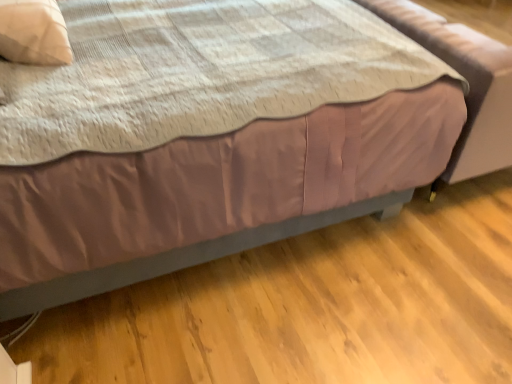
What do you see at coordinates (468, 82) in the screenshot?
I see `pink satin swivel chair at lower right` at bounding box center [468, 82].

You are a GUI agent. You are given a task and a screenshot of the screen. Output one action in this format:
    pyautogui.click(x=<x>, y=<y>)
    Task: Click on the pink satin swivel chair at lower right
    Image resolution: width=512 pixels, height=384 pixels.
    Given the screenshot: What is the action you would take?
    coord(468,82)

Where is `pink satin swivel chair at lower right`? The width and height of the screenshot is (512, 384). pink satin swivel chair at lower right is located at coordinates (468, 82).